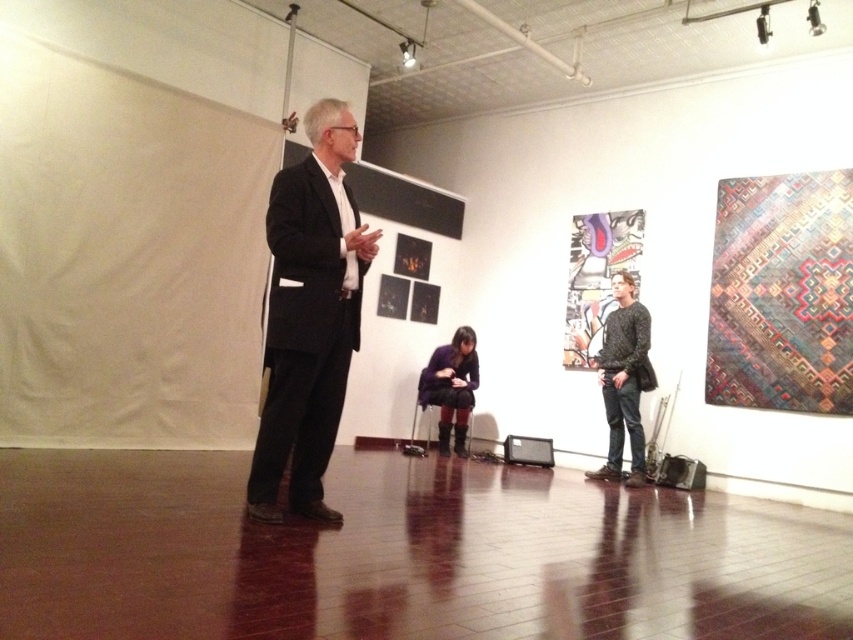
Question: Among these points, which one is farthest from the camera?

Choices:
 (A) coord(315,308)
 (B) coord(624,273)
 (C) coord(456,353)

Answer: (C)

Question: Can you confirm if matte black suit at center is positioned below purple fuzzy sweater at center?

Choices:
 (A) yes
 (B) no

Answer: (B)

Question: Which of these objects is positioned closest to the matte black suit at center?

Choices:
 (A) purple fuzzy sweater at center
 (B) knitted sweater at right

Answer: (B)

Question: Can you confirm if matte black suit at center is wider than purple fuzzy sweater at center?

Choices:
 (A) no
 (B) yes

Answer: (B)

Question: Among these points, which one is farthest from the camera?

Choices:
 (A) (622, 346)
 (B) (267, 397)
 (C) (459, 396)

Answer: (C)

Question: Can you confirm if matte black suit at center is bigger than knitted sweater at right?

Choices:
 (A) yes
 (B) no

Answer: (A)